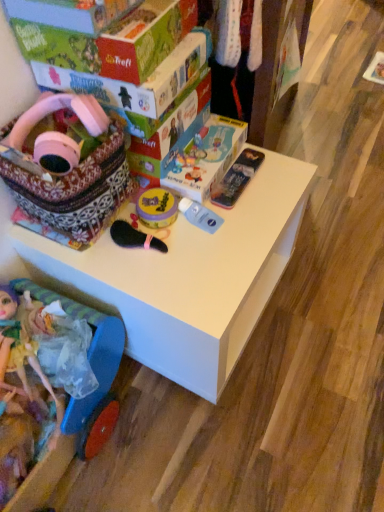
Locate an element on the screen. empty space that is ontop of white matte table at center (from a real-world perspective) is located at coordinates (191, 228).